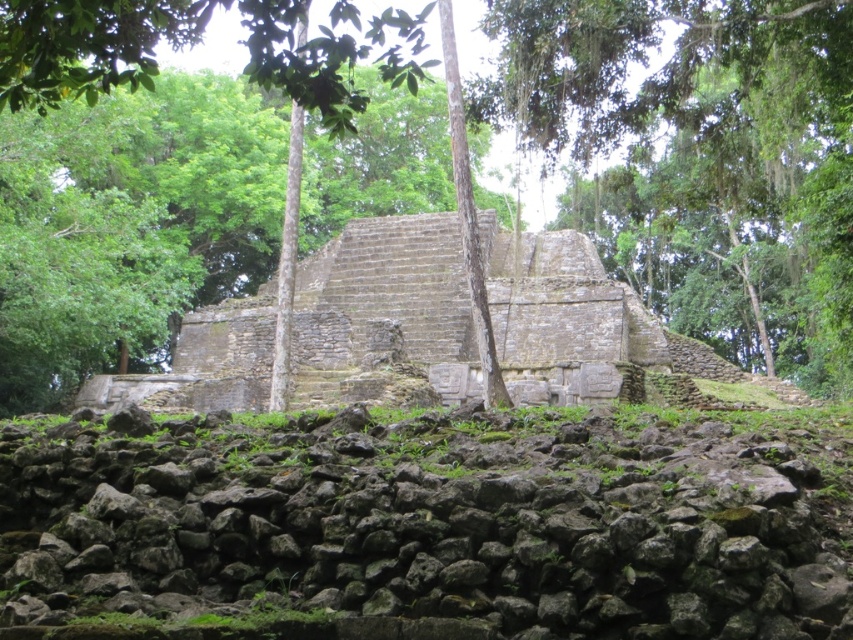
You are an archaeologist standing at the base of the Mayan temple. You notice a rough stone wall at center and a green leafy tree at center. Which object is positioned to the left when facing the temple?

The rough stone wall at center is to the left of the green leafy tree at center, so the rough stone wall at center is positioned to the left when facing the temple.

You are an archaeologist examining the ancient Mayan temple site. You notice the rough stone wall at center and the green leafy tree at center. Which object appears larger in the image?

The green leafy tree at center is larger than the rough stone wall at center.

Based on the photo, you are an archaeologist examining the ancient stone structure. You notice the rough stone wall at center and the green leafy tree at center. Which object is taller?

The green leafy tree at center is taller than the rough stone wall at center.